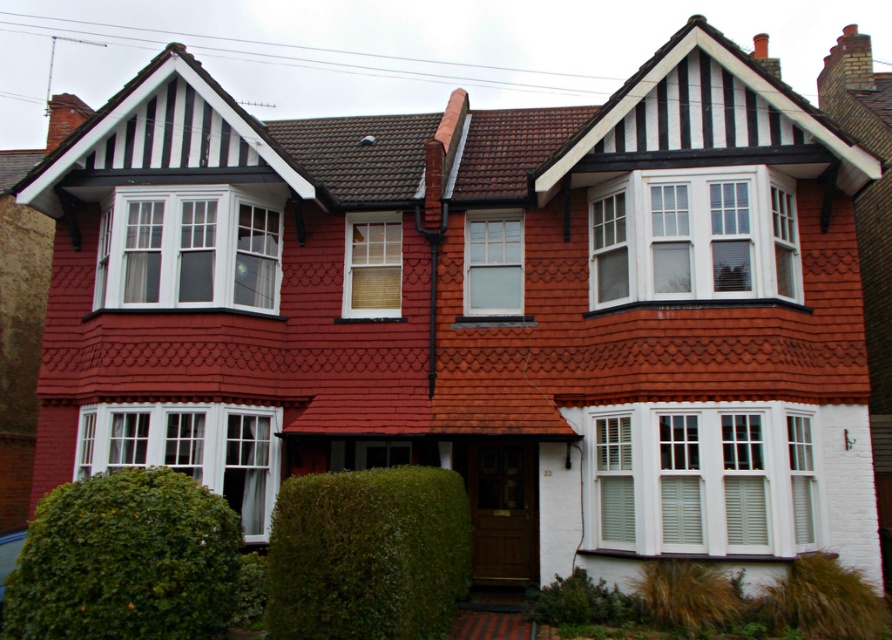
You are a gardener standing at the green leafy hedge at lower left and need to reach the white painted wood shutters at center to clean them. Can you walk directly to them without crossing any obstacles?

The distance between the green leafy hedge at lower left and the white painted wood shutters at center is 11.15 meters. Since there are no mentioned obstacles in the scene description, you can walk directly to them.

You are standing in front of the house and notice the white wood window at lower left and the white painted wood shutter at lower right. Which one appears closer to you?

The white wood window at lower left appears closer to you because it is further to the viewer than the white painted wood shutter at lower right.